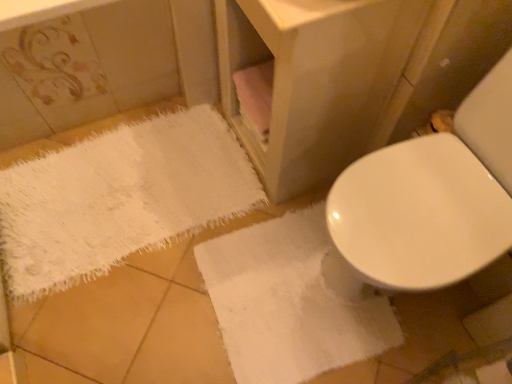
What are the coordinates of `vacant space underneath white fluffy bath towel at lower right, which is the second bath towel in left-to-right order (from a real-world perspective)` in the screenshot? It's located at (270, 299).